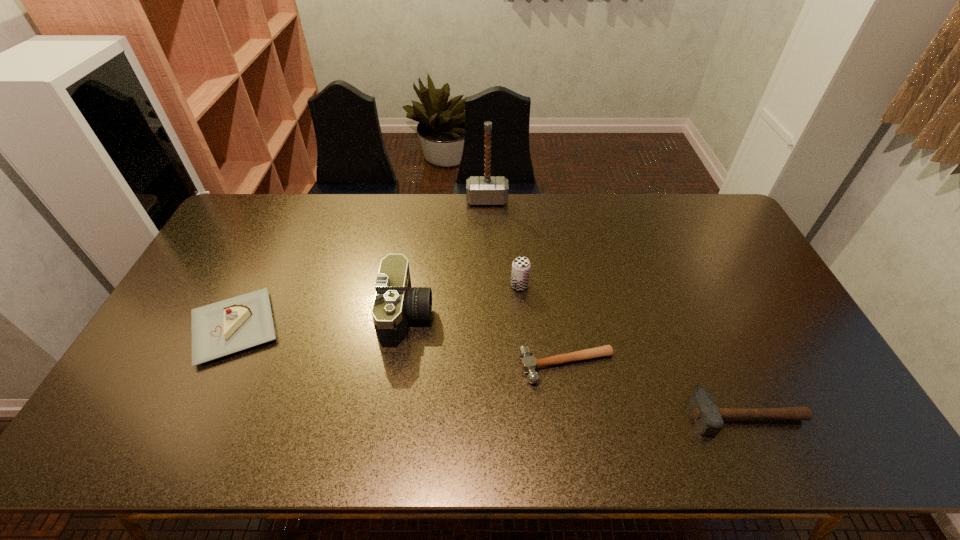
Where is `free point that satisfies the following two spatial constraints: 1. on the striking surface of the shortest hammer; 2. on the left side of the tallest object`? free point that satisfies the following two spatial constraints: 1. on the striking surface of the shortest hammer; 2. on the left side of the tallest object is located at coordinates coord(491,366).

This screenshot has width=960, height=540. Identify the location of free spot that satisfies the following two spatial constraints: 1. on the striking surface of the tallest object; 2. on the front-facing side of the second object from left to right. (490, 316).

You are a GUI agent. You are given a task and a screenshot of the screen. Output one action in this format:
    pyautogui.click(x=<x>, y=<y>)
    Task: Click on the free space that satisfies the following two spatial constraints: 1. on the front side of the shortest hammer; 2. on the left side of the beer can
    The height and width of the screenshot is (540, 960).
    Given the screenshot: What is the action you would take?
    pyautogui.click(x=526, y=366)